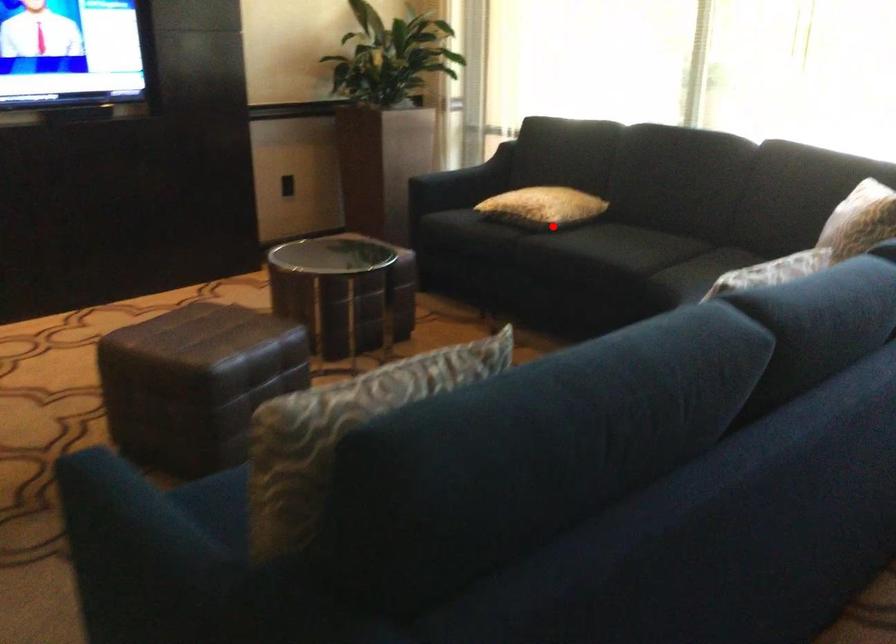
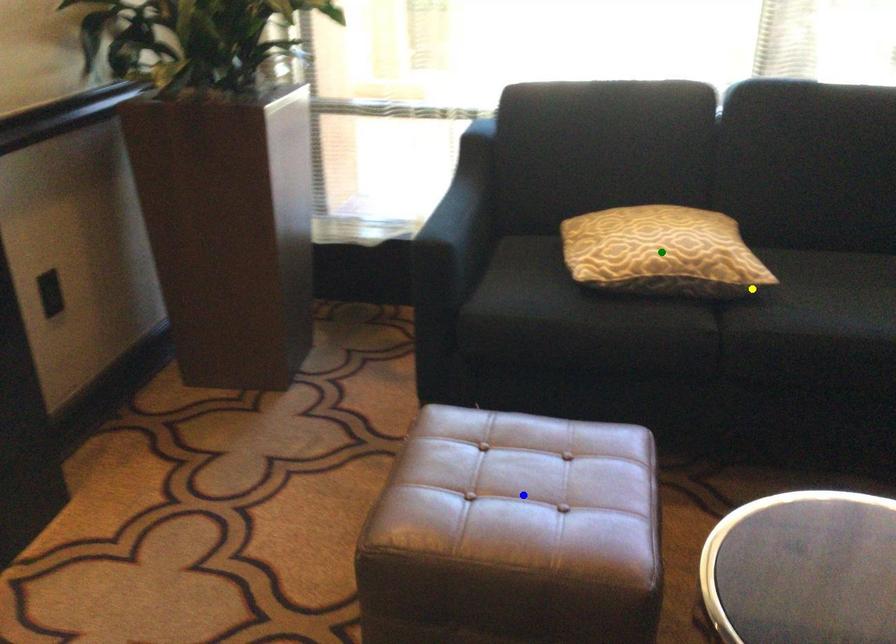
Question: I am providing you with two images of the same scene from different viewpoints. A red point is marked on the first image. You are given multiple points on the second image. Which point in image 2 represents the same 3d spot as the red point in image 1?

Choices:
 (A) yellow point
 (B) green point
 (C) blue point

Answer: (A)